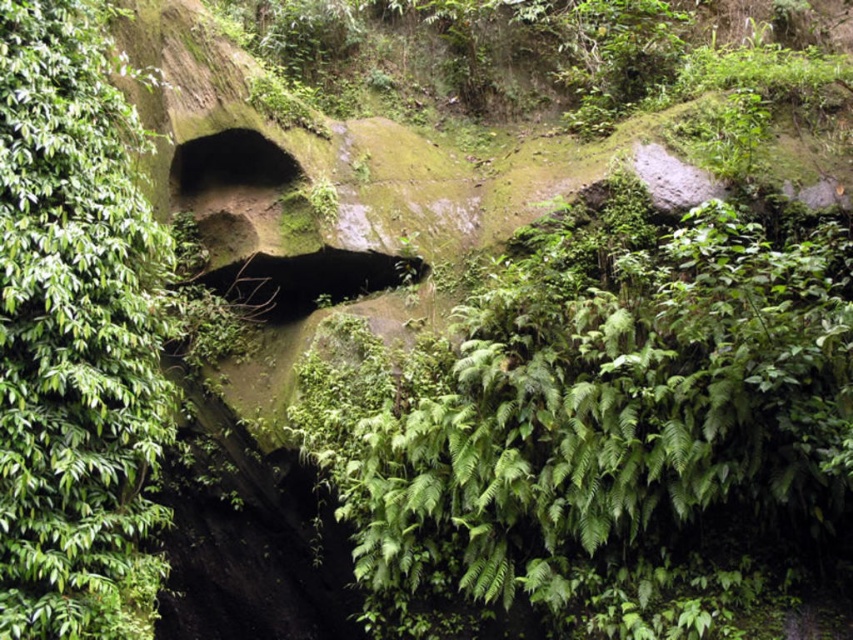
You are an explorer navigating through a dense jungle. You spot the green leafy ferns at center and the green leafy tree at left. Which one is closer to you?

The green leafy ferns at center are closer to you because the green leafy tree at left is behind them.

You are a botanist studying plant growth in tropical environments. You observe the green leafy ferns at center and the green leafy tree at left. Which plant has a larger size?

The green leafy ferns at center has a larger size compared to the green leafy tree at left.